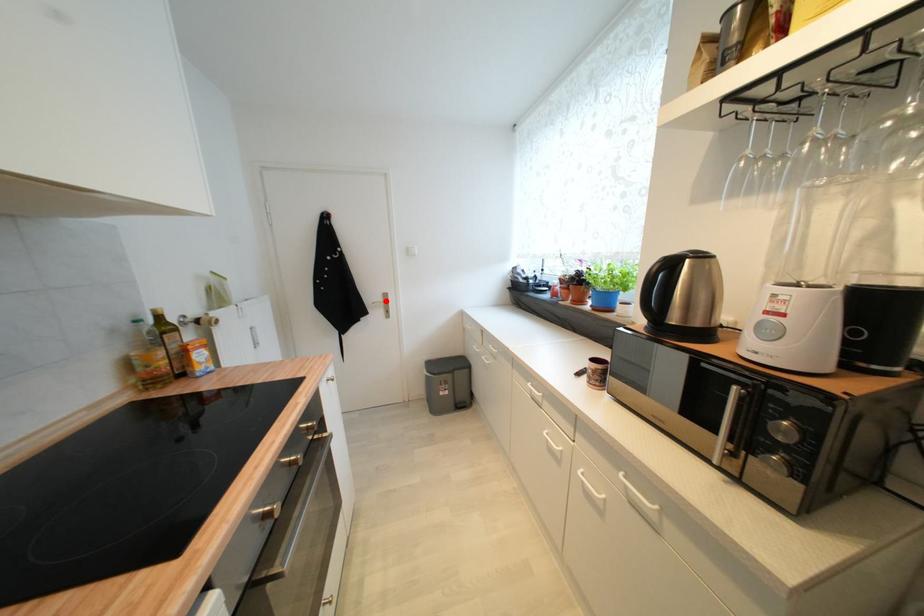
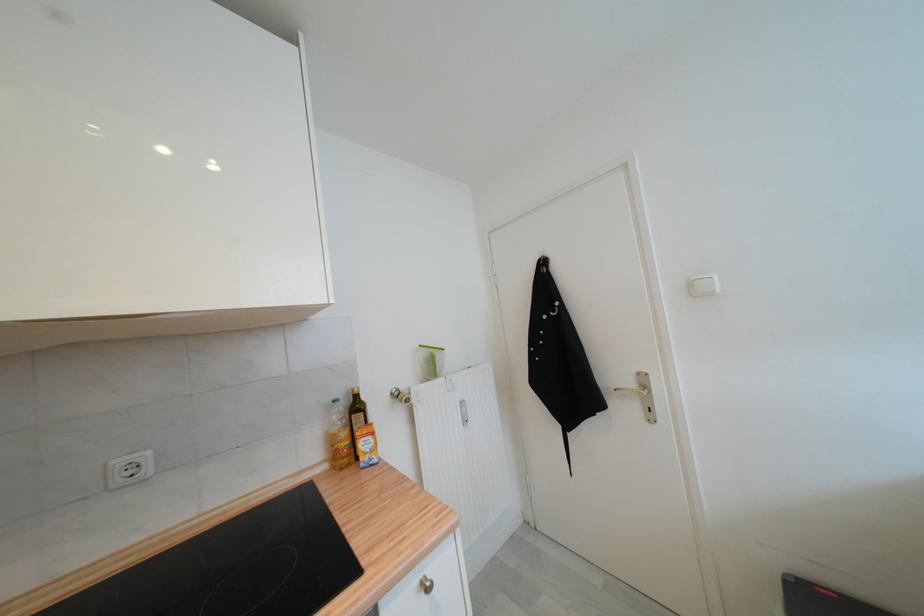
Where in the second image is the point corresponding to the highlighted location from the first image?

(637, 386)